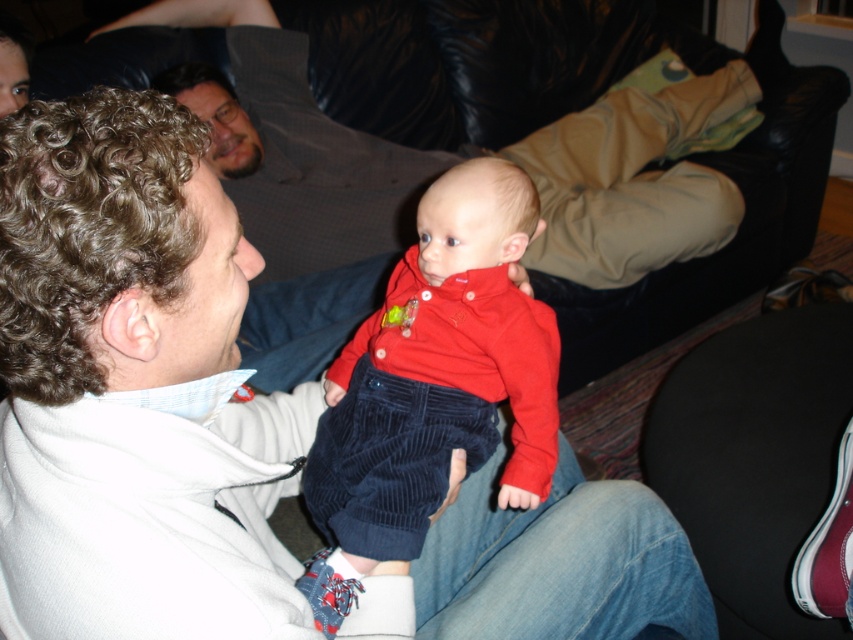
You are standing in the room and want to place a small gift box on the white fleece jacket at center. Where should you place the gift box?

Place the gift box at the 2D coordinates point [132,387] where the white fleece jacket at center is located.

You are a tailor measuring for alterations. You see the velvet corduroy pants at center and the maroon suede shoe at lower right. Which item requires a shorter length adjustment?

The velvet corduroy pants at center requires a shorter length adjustment because it is not as tall as the maroon suede shoe at lower right.

In the scene shown: You are a delivery person holding a package that requires a signature. You see an adult holding a baby and a white fleece jacket at center. Which one should you approach for the signature?

You should approach the adult holding a baby because the white fleece jacket at center is an object and cannot sign for the package.